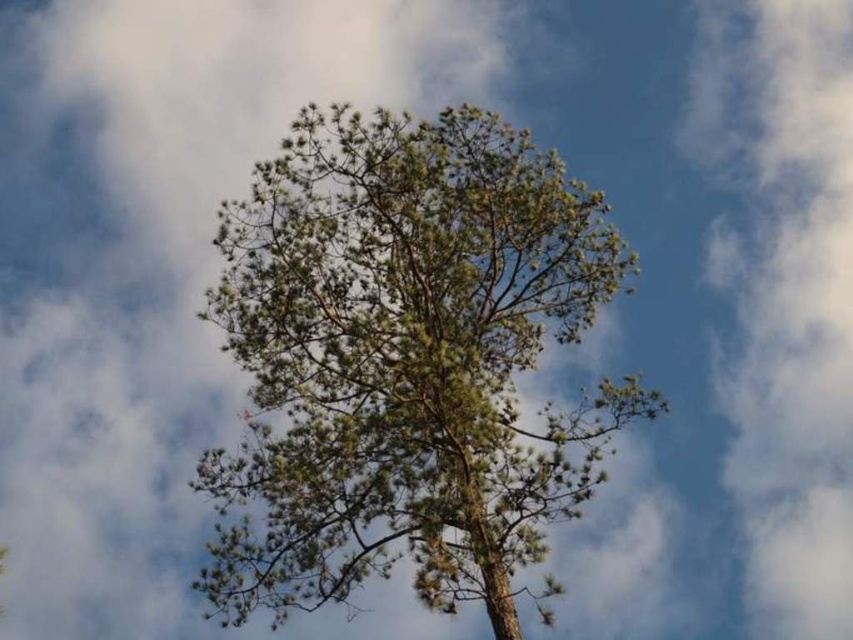
You are an artist sketching the scene. You notice the green leafy tree at center and the white fluffy cloud at upper right. Which object occupies more horizontal space in your drawing?

The green leafy tree at center occupies more horizontal space than the white fluffy cloud at upper right because its width surpasses the cloud.

You are standing in front of the pine tree and notice two points marked on the tree. The first point is at coordinate point (x=492, y=506) and the second is at point (x=790, y=228). Which point is nearer to you?

Point (x=492, y=506) is closer to the camera than point (x=790, y=228), so the first point is nearer to you.

You are standing in a park and see the green leafy tree at center and the white fluffy cloud at upper right. Which object is taller when viewed from your perspective?

The white fluffy cloud at upper right is taller than the green leafy tree at center.